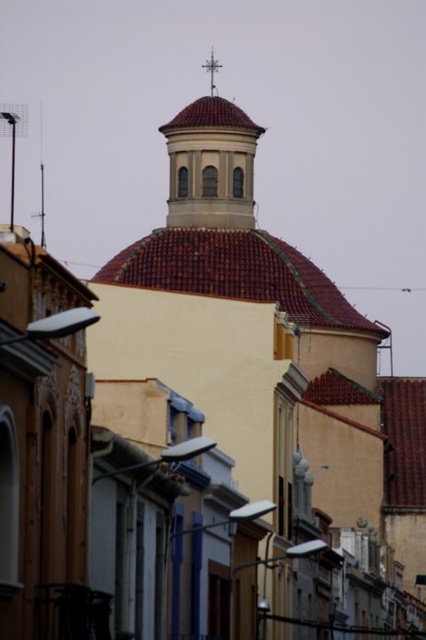
Is matte red tile dome at center to the left of metallic cross at upper center from the viewer's perspective?

Incorrect, matte red tile dome at center is not on the left side of metallic cross at upper center.

Can you confirm if matte red tile dome at center is wider than metallic cross at upper center?

Correct, the width of matte red tile dome at center exceeds that of metallic cross at upper center.

This screenshot has width=426, height=640. I want to click on matte red tile dome at center, so click(210, 163).